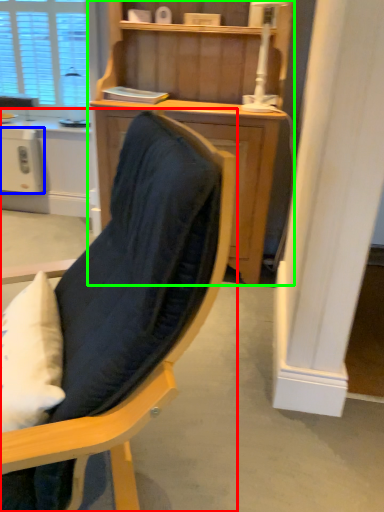
Question: Which object is the farthest from chair (highlighted by a red box)? Choose among these: appliance (highlighted by a blue box) or cupboard (highlighted by a green box).

Choices:
 (A) appliance
 (B) cupboard

Answer: (A)